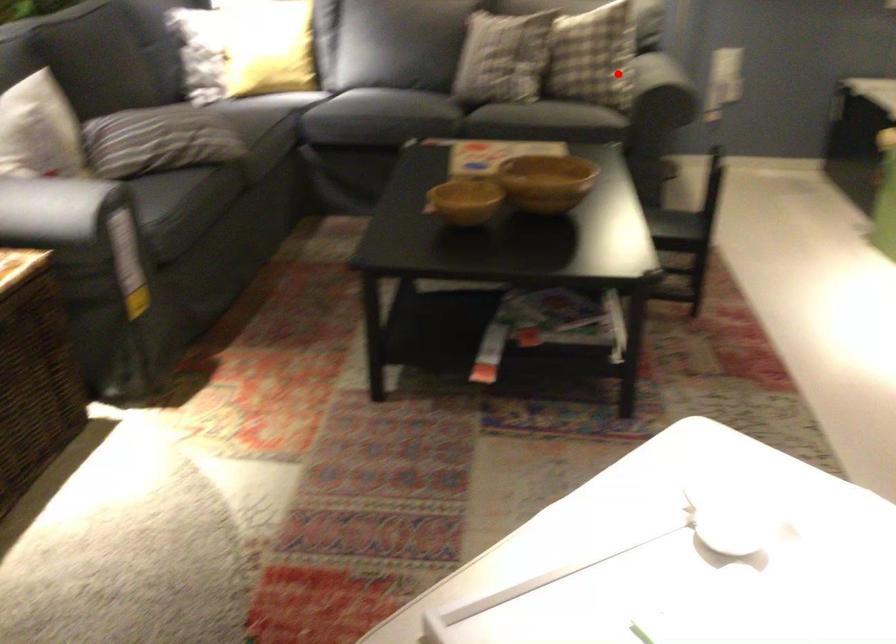
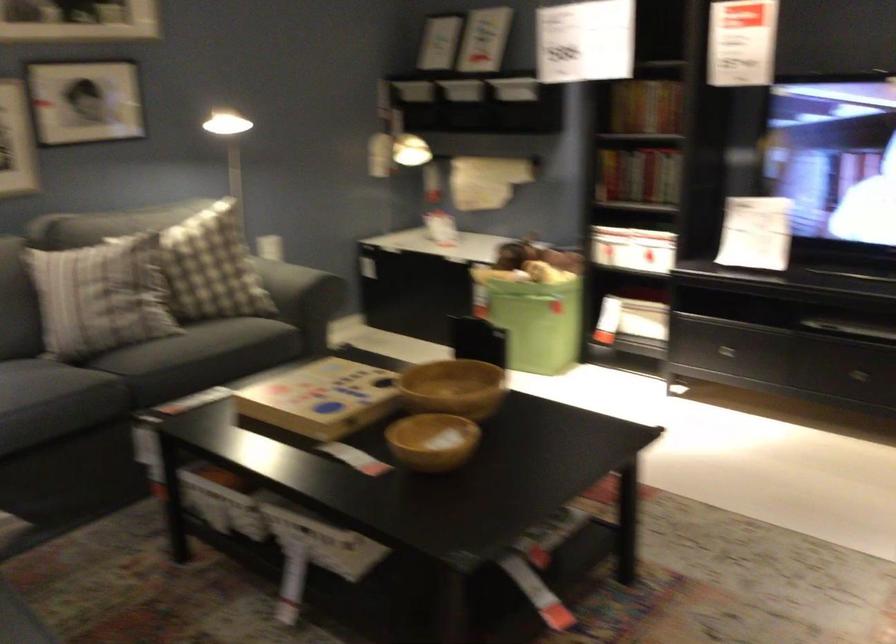
Question: I am providing you with two images of the same scene from different viewpoints. A red point is marked on the first image. Is the red point's position out of view in image 2?

Choices:
 (A) Yes
 (B) No

Answer: (B)